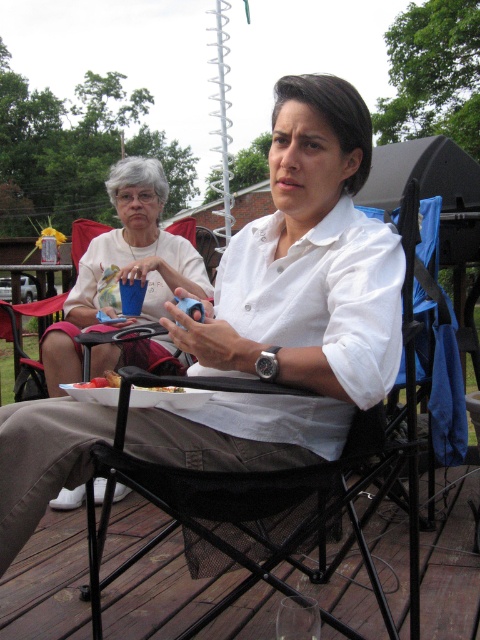
You are a photographer taking a picture of the scene. The white matte shirt at upper center and the blue plastic cup at upper center are both in the frame. Which object is positioned higher in the image?

The white matte shirt at upper center is located above the blue plastic cup at upper center, so it is positioned higher in the image.

You are standing at the center of the image and want to walk to the brown wood deck at lower left. Which direction should you move towards?

Since the brown wood deck at lower left is located at point (x=48, y=582) in the image, you should move towards the lower left direction to reach it.